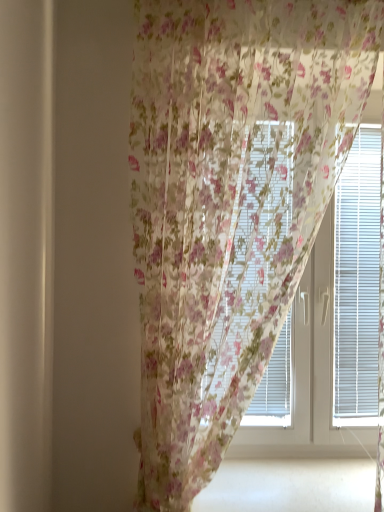
Question: Is floral sheer curtain at center inside or outside of translucent floral curtain at center?

Choices:
 (A) outside
 (B) inside

Answer: (A)

Question: From the image's perspective, relative to translucent floral curtain at center, is floral sheer curtain at center above or below?

Choices:
 (A) below
 (B) above

Answer: (B)

Question: Would you say floral sheer curtain at center is to the left or to the right of translucent floral curtain at center in the picture?

Choices:
 (A) right
 (B) left

Answer: (B)

Question: From the image's perspective, is translucent floral curtain at center above or below floral sheer curtain at center?

Choices:
 (A) above
 (B) below

Answer: (B)

Question: From their relative heights in the image, would you say translucent floral curtain at center is taller or shorter than floral sheer curtain at center?

Choices:
 (A) tall
 (B) short

Answer: (B)

Question: In the image, is translucent floral curtain at center positioned in front of or behind floral sheer curtain at center?

Choices:
 (A) behind
 (B) front

Answer: (A)

Question: Considering the positions of point (374, 443) and point (231, 31), is point (374, 443) closer or farther from the camera than point (231, 31)?

Choices:
 (A) closer
 (B) farther

Answer: (B)